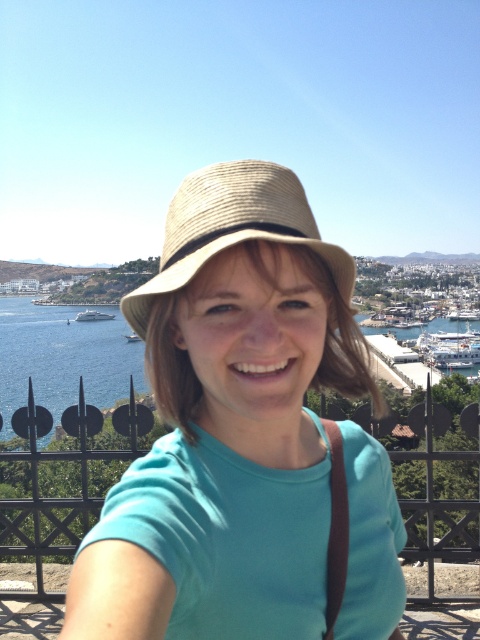
Question: Which point appears farthest from the camera in this image?

Choices:
 (A) (262, 170)
 (B) (68, 324)

Answer: (B)

Question: In this image, where is natural straw hat at center located relative to blue water at center?

Choices:
 (A) right
 (B) left

Answer: (B)

Question: Which of the following is the farthest from the observer?

Choices:
 (A) blue water at center
 (B) natural straw hat at center

Answer: (A)

Question: Is matte straw hat at center below natural straw hat at center?

Choices:
 (A) yes
 (B) no

Answer: (A)

Question: Considering the relative positions of matte straw hat at center and natural straw hat at center in the image provided, where is matte straw hat at center located with respect to natural straw hat at center?

Choices:
 (A) left
 (B) right

Answer: (B)

Question: Estimate the real-world distances between objects in this image. Which object is closer to the matte straw hat at center?

Choices:
 (A) blue water at center
 (B) natural straw hat at center

Answer: (B)